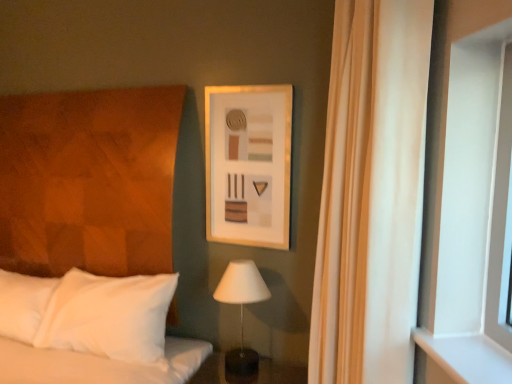
Question: Is white matte table lamp at center bigger or smaller than white matte window at right?

Choices:
 (A) small
 (B) big

Answer: (B)

Question: Looking at their shapes, would you say white matte table lamp at center is wider or thinner than white matte window at right?

Choices:
 (A) thin
 (B) wide

Answer: (B)

Question: Which of these objects is positioned farthest from the matte wooden picture frame at upper center?

Choices:
 (A) white matte table lamp at center
 (B) white matte window at right
 (C) beige fabric curtain at right

Answer: (B)

Question: Which of these objects is positioned farthest from the white matte window at right?

Choices:
 (A) white matte table lamp at center
 (B) matte wooden picture frame at upper center
 (C) beige fabric curtain at right

Answer: (A)